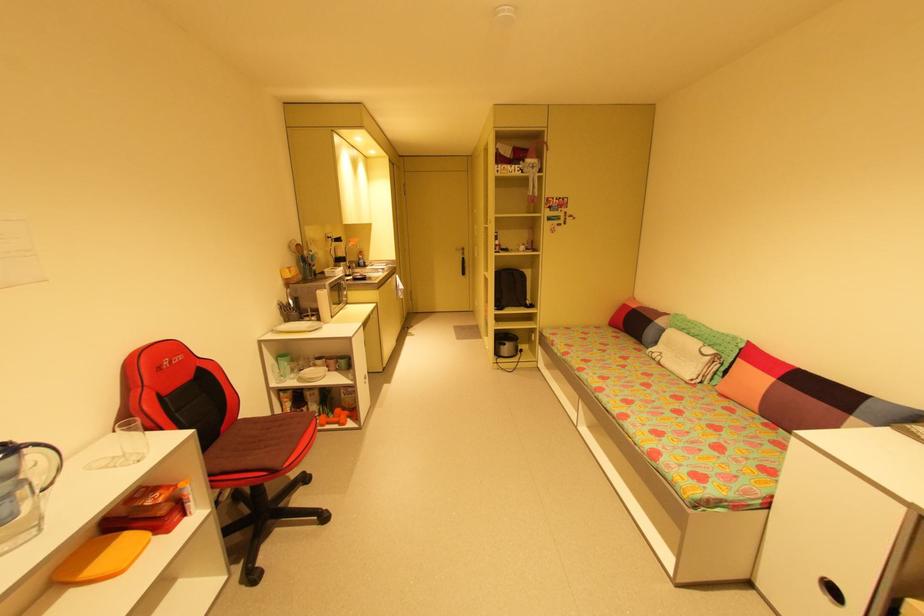
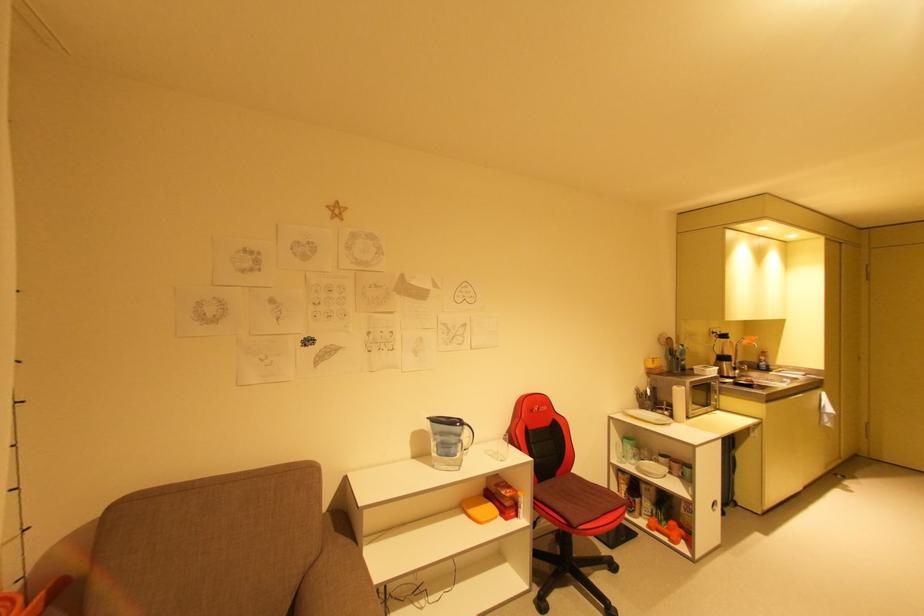
In the second image, find the point that corresponds to point 30,450 in the first image.

(469, 427)